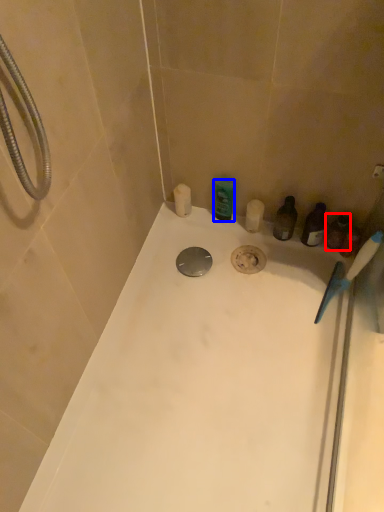
Question: Which point is closer to the camera, toiletry (highlighted by a red box) or toiletry (highlighted by a blue box)?

Choices:
 (A) toiletry
 (B) toiletry

Answer: (A)